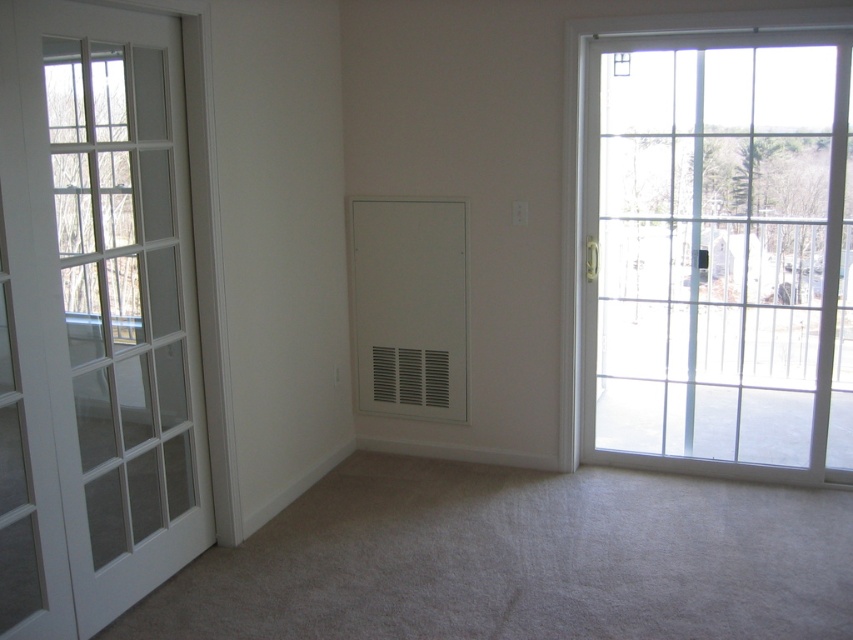
You are standing in the room and want to exit through the clear glass door at right. To reach it, you must walk past the point labeled as point (718, 253). Is the clear glass door at right located to the north or south of this point?

The clear glass door at right is located to the north of point (718, 253).

You are a delivery person with a large package that measures 2.5 meters in length. You need to move it through the space between the clear glass door at right and the white glass door at left. Can the package fit through the space between them?

The clear glass door at right and white glass door at left are 3.01 meters apart, so the 2.5 meters package can fit through the space between them since it is shorter than the available distance.

You are a delivery person trying to place a package on the floor near the clear glass door at right without blocking the white matte vent at center. Where should you place the package?

The clear glass door at right is located above the white matte vent at center, so placing the package near the base of the clear glass door at right would ensure it does not block the white matte vent at center.